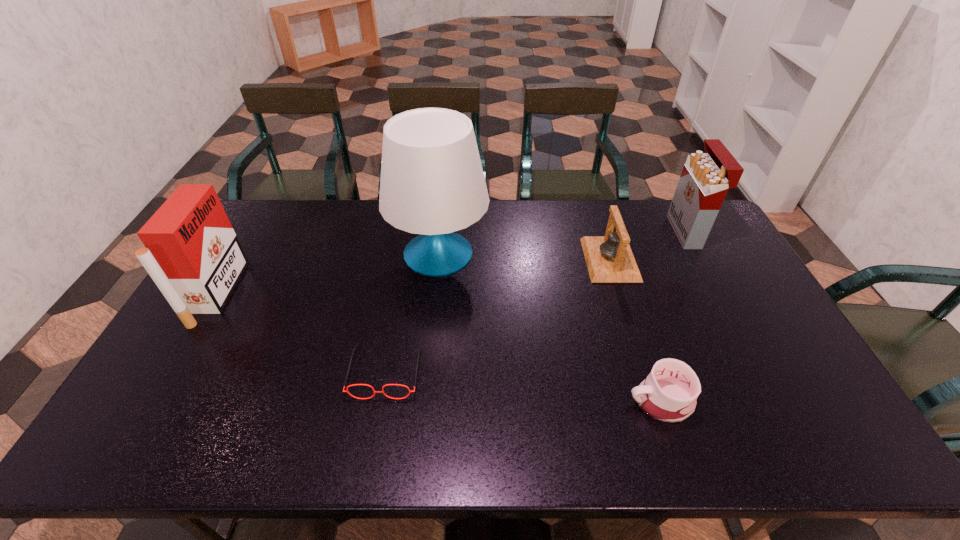
Where is `free space located with the lid open on the rightmost object`? The height and width of the screenshot is (540, 960). free space located with the lid open on the rightmost object is located at coordinates (658, 232).

You are a GUI agent. You are given a task and a screenshot of the screen. Output one action in this format:
    pyautogui.click(x=<x>, y=<y>)
    Task: Click on the vacant position located 0.090m with the lid open on the rightmost object
    
    Given the screenshot: What is the action you would take?
    pyautogui.click(x=650, y=232)

You are a GUI agent. You are given a task and a screenshot of the screen. Output one action in this format:
    pyautogui.click(x=<x>, y=<y>)
    Task: Click on the blank space located 0.160m on the front-facing side of the nearer cigarette case
    This screenshot has height=540, width=960.
    Given the screenshot: What is the action you would take?
    pyautogui.click(x=283, y=293)

Where is `free space located 0.330m on the right of the third shortest object`? This screenshot has height=540, width=960. free space located 0.330m on the right of the third shortest object is located at coordinates (733, 260).

Locate an element on the screen. free space located 0.170m on the side with the handle of the second shortest object is located at coordinates (559, 401).

I want to click on vacant space located on the side with the handle of the second shortest object, so click(479, 401).

The image size is (960, 540). I want to click on vacant space located 0.390m on the side with the handle of the second shortest object, so pyautogui.click(x=470, y=401).

At what (x,y) coordinates should I click in order to perform the action: click on vacant space situated on the front-facing side of the spectacles. Please return your answer as a coordinate pair (x, y). The width and height of the screenshot is (960, 540). Looking at the image, I should click on (372, 447).

You are a GUI agent. You are given a task and a screenshot of the screen. Output one action in this format:
    pyautogui.click(x=<x>, y=<y>)
    Task: Click on the table lamp that is at the far edge
    
    Given the screenshot: What is the action you would take?
    (432, 183)

Where is `cigarette case that is at the far edge`? The width and height of the screenshot is (960, 540). cigarette case that is at the far edge is located at coordinates (706, 177).